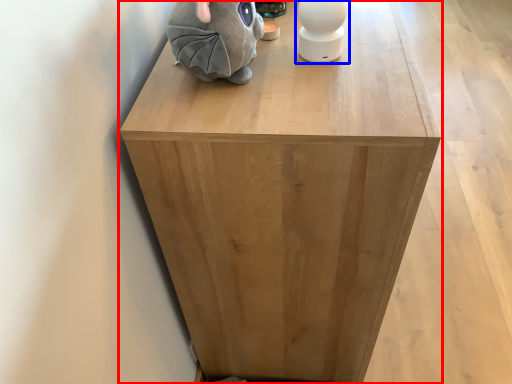
Question: Which object appears closest to the camera in this image, furniture (highlighted by a red box) or toy (highlighted by a blue box)?

Choices:
 (A) furniture
 (B) toy

Answer: (A)